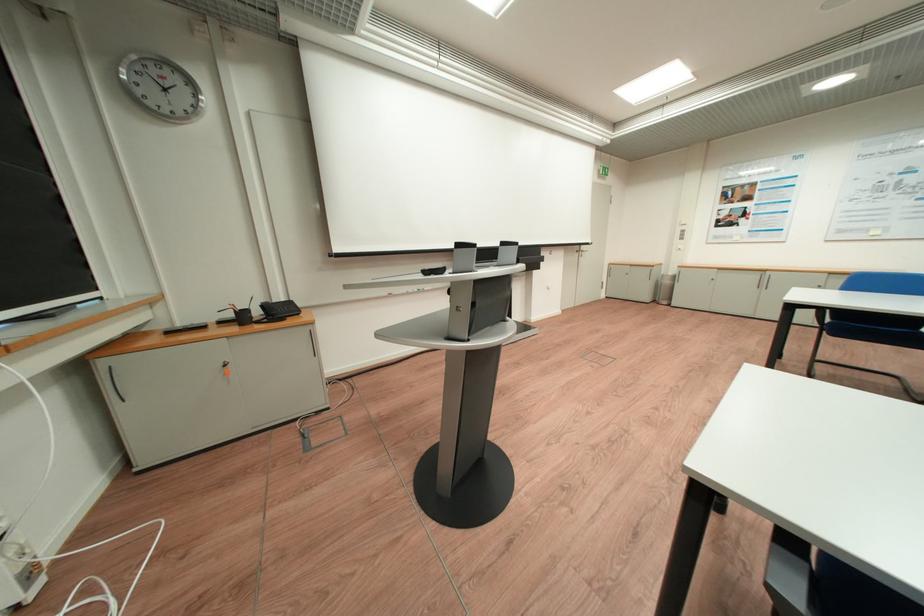
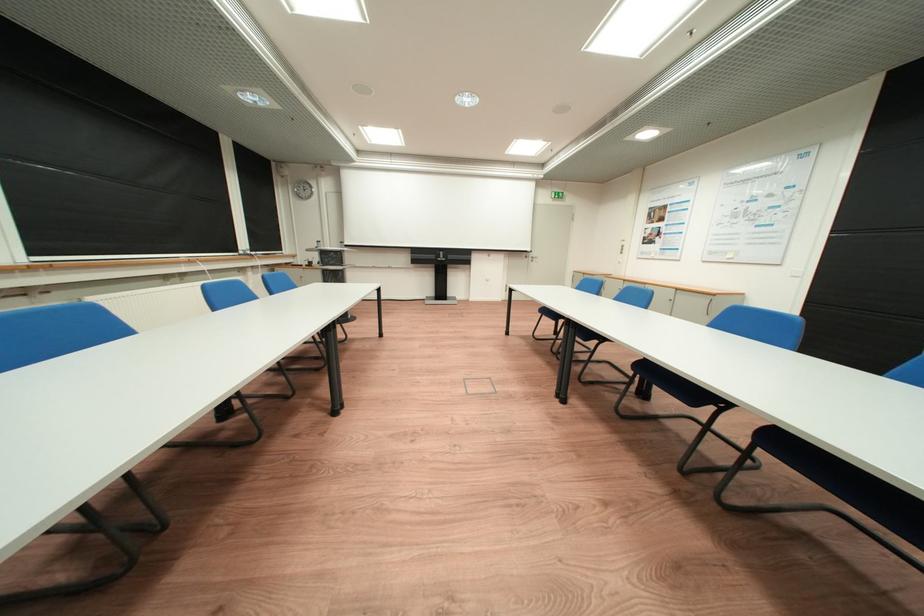
The images are taken continuously from a first-person perspective. In which direction are you moving?

The cameraman walked toward right, backward.